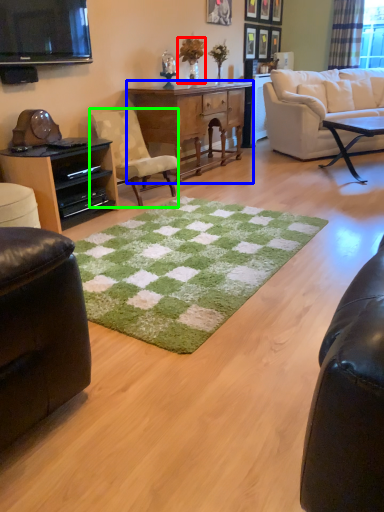
Question: Considering the real-world distances, which object is farthest from houseplant (highlighted by a red box)? desk (highlighted by a blue box) or chair (highlighted by a green box)?

Choices:
 (A) desk
 (B) chair

Answer: (B)